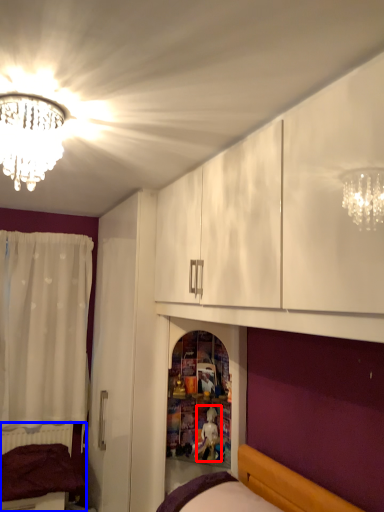
Question: Among these objects, which one is farthest to the camera, toy (highlighted by a red box) or bed (highlighted by a blue box)?

Choices:
 (A) toy
 (B) bed

Answer: (B)